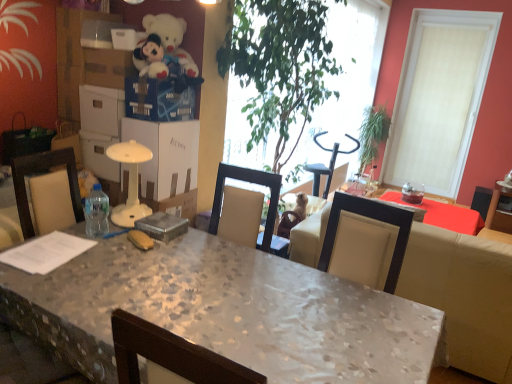
Question: Does point (166, 145) appear closer or farther from the camera than point (184, 225)?

Choices:
 (A) closer
 (B) farther

Answer: (B)

Question: Is white cardboard box at center bigger or smaller than metallic gray box at center?

Choices:
 (A) small
 (B) big

Answer: (B)

Question: Estimate the real-world distances between objects in this image. Which object is closer to the clear plastic bottle at table left?

Choices:
 (A) white plush teddy bear at upper left
 (B) green leafy plant at center, positioned as the 2th houseplant in back-to-front order
 (C) white cardboard box at center
 (D) marble textured desk at center
 (E) metallic gray box at center

Answer: (E)

Question: Considering the real-world distances, which object is closest to the green leafy plant at upper right, which ranks as the first houseplant in right-to-left order?

Choices:
 (A) white cardboard box at center
 (B) metallic gray box at center
 (C) green leafy plant at center, which is counted as the 1th houseplant, starting from the front
 (D) white plush teddy bear at upper left
 (E) clear plastic bottle at table left

Answer: (C)